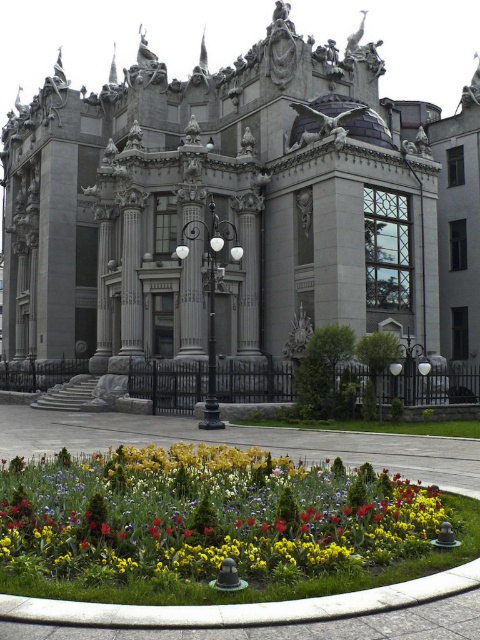
Who is higher up, gray stone palace at center or yellow matte flowers at lower center?

gray stone palace at center is higher up.

Between gray stone palace at center and yellow matte flowers at lower center, which one appears on the left side from the viewer's perspective?

gray stone palace at center is more to the left.

Image resolution: width=480 pixels, height=640 pixels. In order to click on gray stone palace at center in this screenshot , I will do `click(239, 208)`.

This screenshot has height=640, width=480. What are the coordinates of `gray stone palace at center` in the screenshot? It's located at (239, 208).